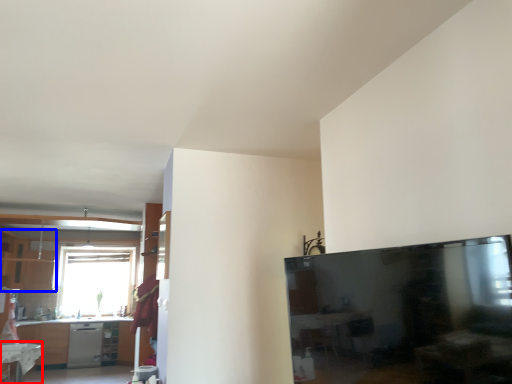
Question: Which of the following is the farthest to the observer, table (highlighted by a red box) or cabinetry (highlighted by a blue box)?

Choices:
 (A) table
 (B) cabinetry

Answer: (B)